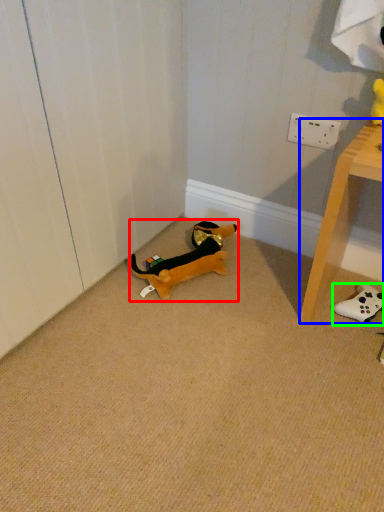
Question: Based on their relative distances, which object is nearer to toy (highlighted by a red box)? Choose from furniture (highlighted by a blue box) and toy (highlighted by a green box).

Choices:
 (A) furniture
 (B) toy

Answer: (A)